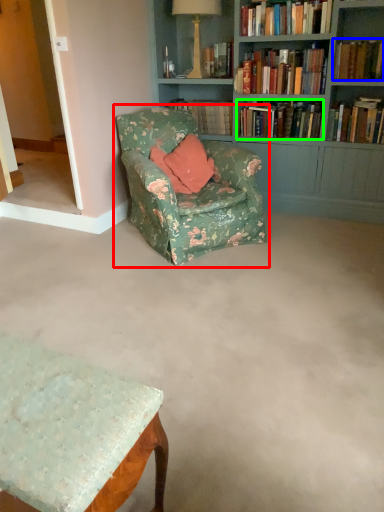
Question: Which object is positioned farthest from chair (highlighted by a red box)? Select from book (highlighted by a blue box) and book (highlighted by a green box).

Choices:
 (A) book
 (B) book

Answer: (A)